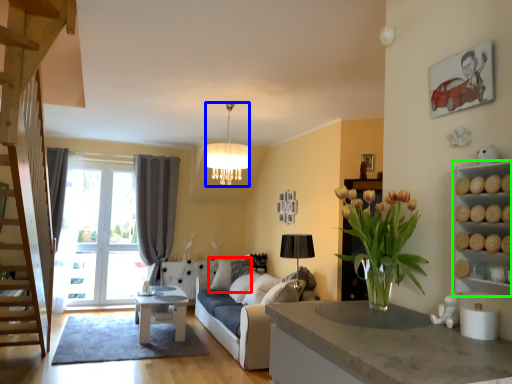
Question: Considering the real-world distances, which object is farthest from pillow (highlighted by a red box)? lamp (highlighted by a blue box) or cabinet (highlighted by a green box)?

Choices:
 (A) lamp
 (B) cabinet

Answer: (B)